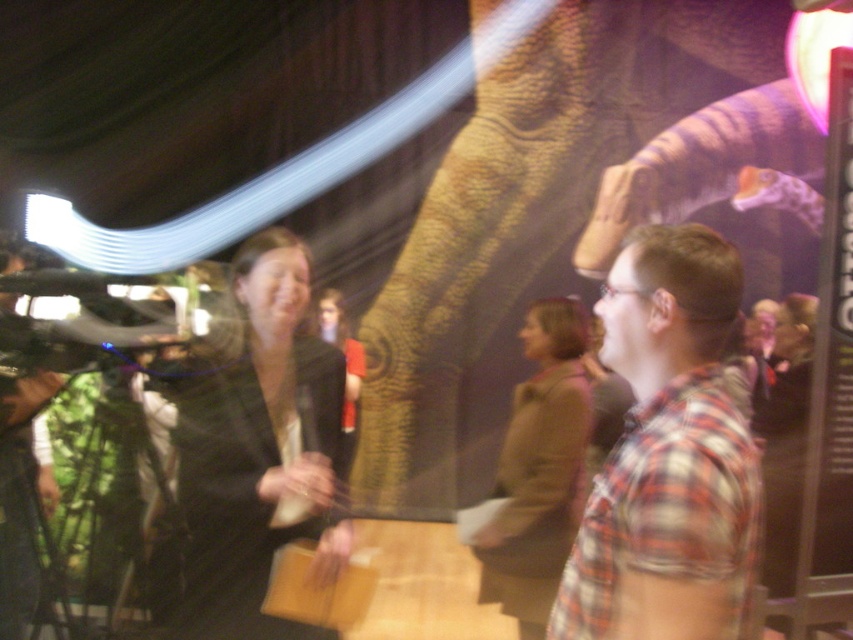
Does brown textured trunk at center have a greater height compared to black fabric dress at center?

Yes.

Which is behind, point (764, 1) or point (184, 572)?

Point (764, 1)

Identify the location of brown textured trunk at center. The width and height of the screenshot is (853, 640). (525, 225).

How much distance is there between brown textured trunk at center and brown wool sweater at center?

8.31 feet

Identify the location of brown textured trunk at center. The height and width of the screenshot is (640, 853). (525, 225).

This screenshot has width=853, height=640. I want to click on brown textured trunk at center, so click(x=525, y=225).

Who is positioned more to the right, plaid cotton shirt at right or black fabric dress at center?

plaid cotton shirt at right

Does plaid cotton shirt at right have a smaller size compared to black fabric dress at center?

Actually, plaid cotton shirt at right might be larger than black fabric dress at center.

Between point (717, 403) and point (254, 609), which one is positioned behind?

Point (254, 609)

Locate an element on the screen. The width and height of the screenshot is (853, 640). plaid cotton shirt at right is located at coordinates click(669, 454).